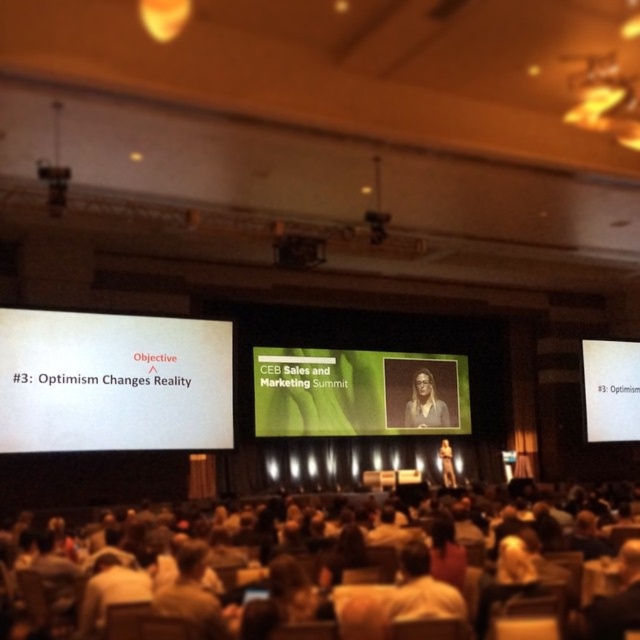
This screenshot has height=640, width=640. What do you see at coordinates (113, 381) in the screenshot? I see `white matte projector screen at left` at bounding box center [113, 381].

Is point (28, 396) farther from viewer compared to point (394, 404)?

That is False.

Is point (20, 314) behind point (292, 435)?

No, it is in front of (292, 435).

Find the location of a particular element. white matte projector screen at left is located at coordinates (113, 381).

Can you confirm if white matte projector screen at left is bigger than blonde hair at center?

Correct, white matte projector screen at left is larger in size than blonde hair at center.

Is white matte projector screen at left further to the viewer compared to blonde hair at center?

No, it is not.

In the scene shown: Measure the distance between point (208, 371) and camera.

Point (208, 371) and camera are 47.13 meters apart.

At what (x,y) coordinates should I click in order to perform the action: click on white matte projector screen at left. Please return your answer as a coordinate pair (x, y). Looking at the image, I should click on (113, 381).

Can you confirm if white paper at center is wider than matte black suit at center?

Correct, the width of white paper at center exceeds that of matte black suit at center.

Is white paper at center further to camera compared to matte black suit at center?

No, white paper at center is closer to the viewer.

Which is in front, point (621, 352) or point (444, 464)?

Point (444, 464)

You are a GUI agent. You are given a task and a screenshot of the screen. Output one action in this format:
    pyautogui.click(x=<x>, y=<y>)
    Task: Click on the white paper at center
    The height and width of the screenshot is (640, 640).
    Given the screenshot: What is the action you would take?
    pyautogui.click(x=611, y=388)